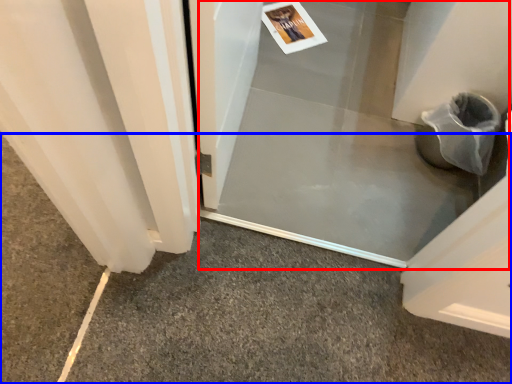
Question: Which object appears farthest to the camera in this image, screen door (highlighted by a red box) or concrete (highlighted by a blue box)?

Choices:
 (A) screen door
 (B) concrete

Answer: (A)